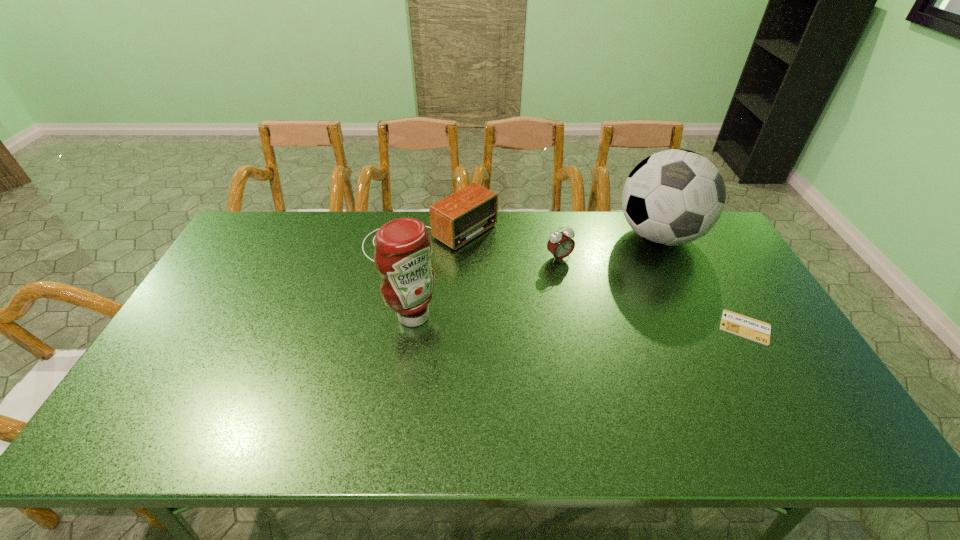
At what (x,y) coordinates should I click in order to perform the action: click on soccer ball at the right edge. Please return your answer as a coordinate pair (x, y). Looking at the image, I should click on [673, 197].

This screenshot has width=960, height=540. I want to click on object positioned at the far right corner, so click(x=673, y=197).

This screenshot has width=960, height=540. I want to click on vacant region at the far edge of the desktop, so click(x=302, y=241).

Locate an element on the screen. The width and height of the screenshot is (960, 540). vacant area at the near edge is located at coordinates (553, 401).

Find the location of `vacant region at the left edge of the desktop`. vacant region at the left edge of the desktop is located at coordinates (218, 272).

In the image, there is a desktop. Where is `vacant space at the right edge`? The width and height of the screenshot is (960, 540). vacant space at the right edge is located at coordinates (755, 353).

At what (x,y) coordinates should I click in order to perform the action: click on blank space at the near left corner of the desktop. Please return your answer as a coordinate pair (x, y). Looking at the image, I should click on 136,402.

Where is `empty space between the soccer ball and the radio receiver`? The width and height of the screenshot is (960, 540). empty space between the soccer ball and the radio receiver is located at coordinates (545, 237).

Identify the location of vacant area that lies between the alarm clock and the soccer ball. (609, 247).

The width and height of the screenshot is (960, 540). In order to click on blank region between the third object from right to left and the radio receiver in this screenshot , I will do `click(495, 247)`.